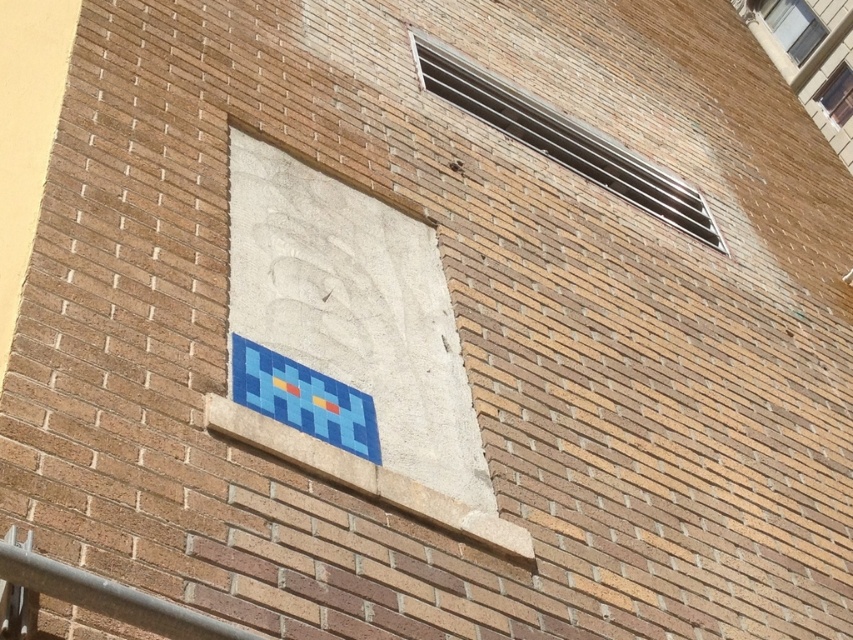
Question: Does metallic silver vent at upper right appear over metallic gray rail at lower left?

Choices:
 (A) no
 (B) yes

Answer: (B)

Question: Which object is farther from the camera taking this photo?

Choices:
 (A) metallic gray rail at lower left
 (B) transparent glass window at upper right
 (C) clear glass window at upper right

Answer: (C)

Question: Is metallic silver vent at upper right smaller than transparent glass window at upper right?

Choices:
 (A) no
 (B) yes

Answer: (A)

Question: Which point appears farthest from the camera in this image?

Choices:
 (A) (146, 605)
 (B) (842, 112)

Answer: (B)

Question: Can you confirm if metallic silver vent at upper right is wider than metallic gray rail at lower left?

Choices:
 (A) yes
 (B) no

Answer: (A)

Question: Which is farther from the metallic gray rail at lower left?

Choices:
 (A) clear glass window at upper right
 (B) metallic silver vent at upper right

Answer: (A)